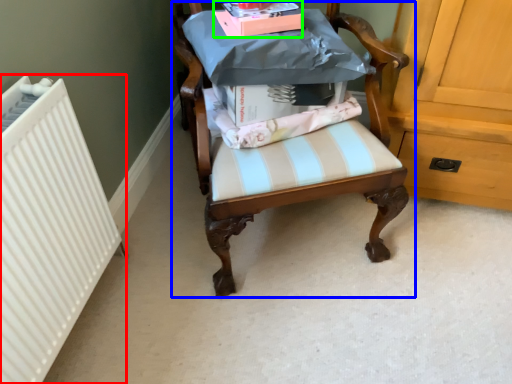
Question: Estimate the real-world distances between objects in this image. Which object is closer to radiator (highlighted by a red box), chair (highlighted by a blue box) or book (highlighted by a green box)?

Choices:
 (A) chair
 (B) book

Answer: (A)